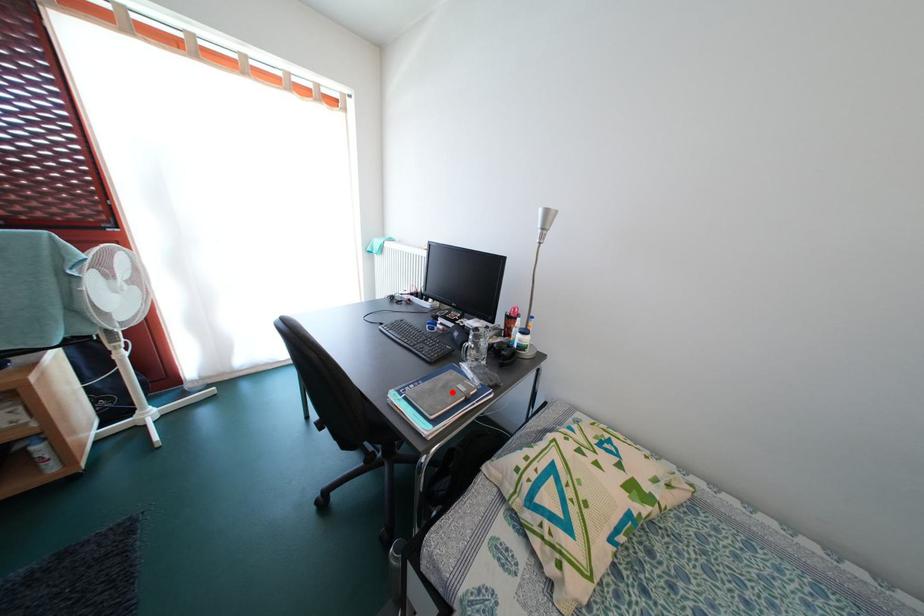
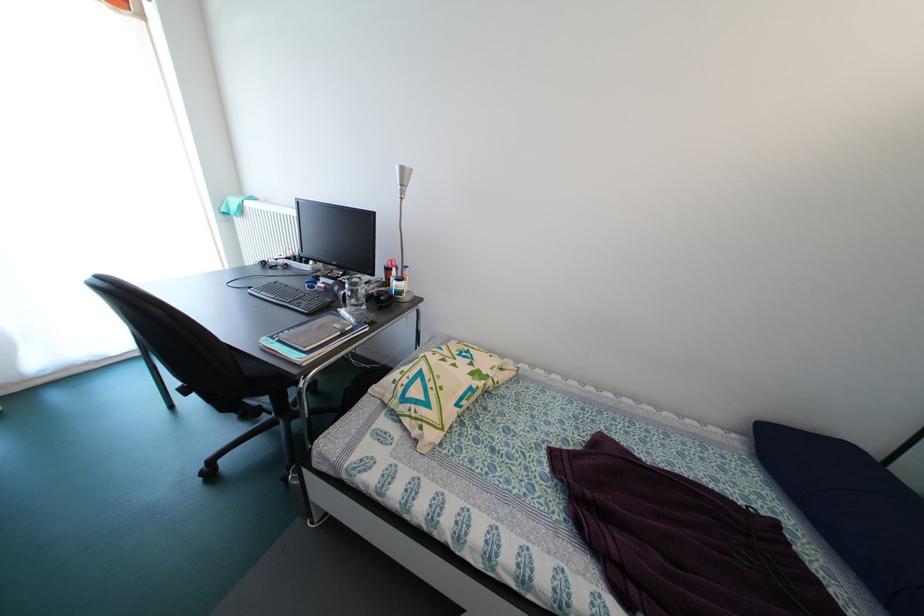
Question: I am providing you with two images of the same scene from different viewpoints. A red point is marked on the first image. At the location where the point appears in image 1, is it still visible in image 2?

Choices:
 (A) Yes
 (B) No

Answer: (A)